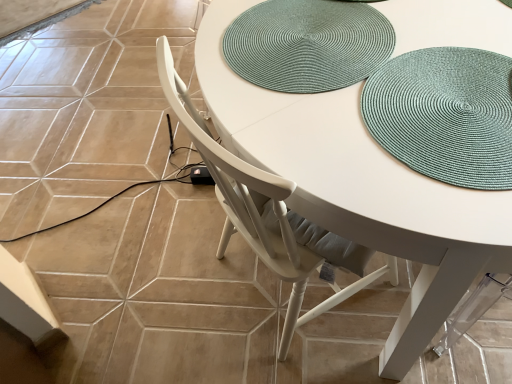
You are a GUI agent. You are given a task and a screenshot of the screen. Output one action in this format:
    pyautogui.click(x=<x>, y=<y>)
    Task: Click on the vacant space underneath teal woven placemat at upper right (from a real-world perspective)
    
    Given the screenshot: What is the action you would take?
    pyautogui.click(x=472, y=121)